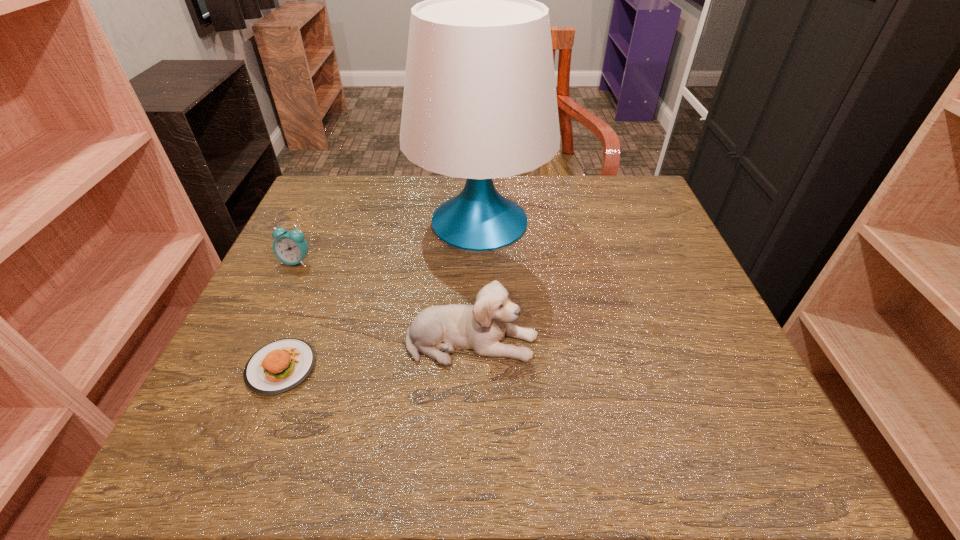
Where is `free location that satisfies the following two spatial constraints: 1. on the face of the third tallest object; 2. on the right side of the shortest object`? The image size is (960, 540). free location that satisfies the following two spatial constraints: 1. on the face of the third tallest object; 2. on the right side of the shortest object is located at coordinates click(x=248, y=368).

Locate an element on the screen. Image resolution: width=960 pixels, height=540 pixels. vacant point that satisfies the following two spatial constraints: 1. on the front-facing side of the tallest object; 2. on the face of the third tallest object is located at coordinates tap(480, 262).

Find the location of a particular element. The height and width of the screenshot is (540, 960). free space that satisfies the following two spatial constraints: 1. on the front-facing side of the second tallest object; 2. on the front side of the food is located at coordinates (471, 368).